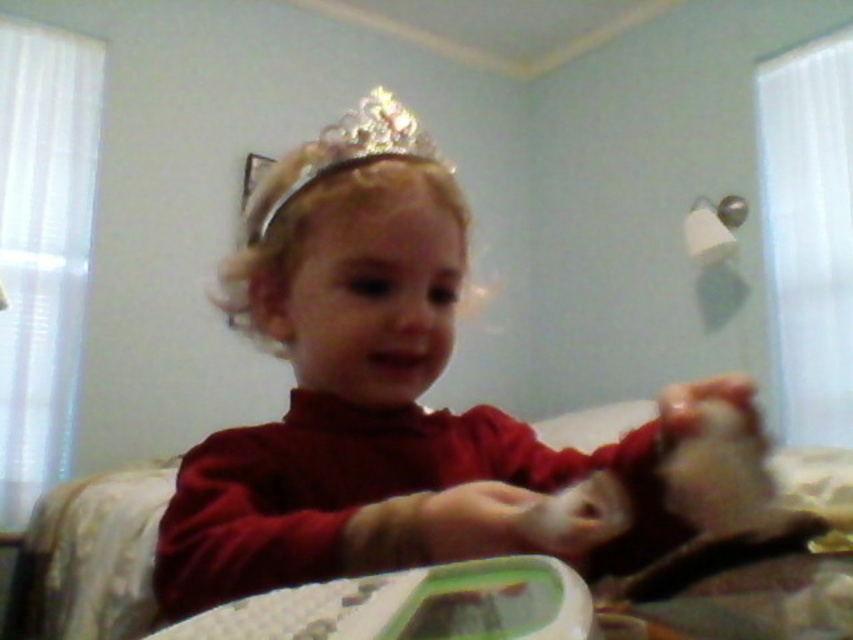
Measure the distance between matte red shirt at center and sparkly gold crown at upper center.

A distance of 2.79 meters exists between matte red shirt at center and sparkly gold crown at upper center.

Can you confirm if matte red shirt at center is positioned above sparkly gold crown at upper center?

No, matte red shirt at center is not above sparkly gold crown at upper center.

Between point (311, 380) and point (372, 99), which one is positioned in front?

Point (311, 380) is more forward.

You are a GUI agent. You are given a task and a screenshot of the screen. Output one action in this format:
    pyautogui.click(x=<x>, y=<y>)
    Task: Click on the matte red shirt at center
    
    Given the screenshot: What is the action you would take?
    pyautogui.click(x=366, y=387)